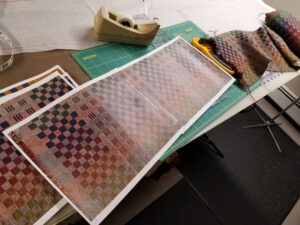
Where is `measurement/blueprint board`? The image size is (300, 225). measurement/blueprint board is located at coordinates (103, 58).